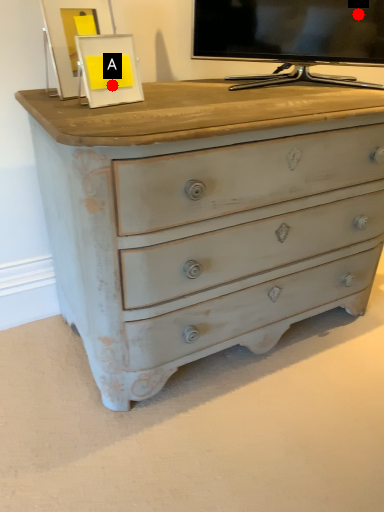
Question: Two points are circled on the image, labeled by A and B beside each circle. Which of the following is the closest to the observer?

Choices:
 (A) A is closer
 (B) B is closer

Answer: (A)